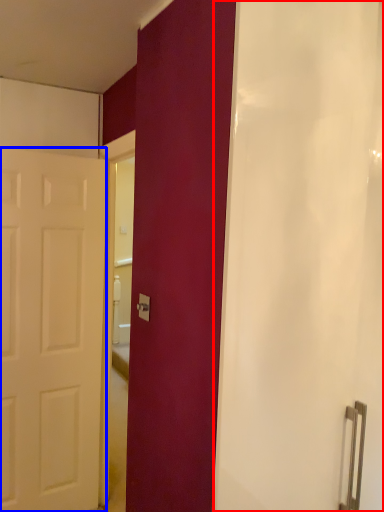
Question: Which of the following is the farthest to the observer, shower curtain (highlighted by a red box) or door (highlighted by a blue box)?

Choices:
 (A) shower curtain
 (B) door

Answer: (B)